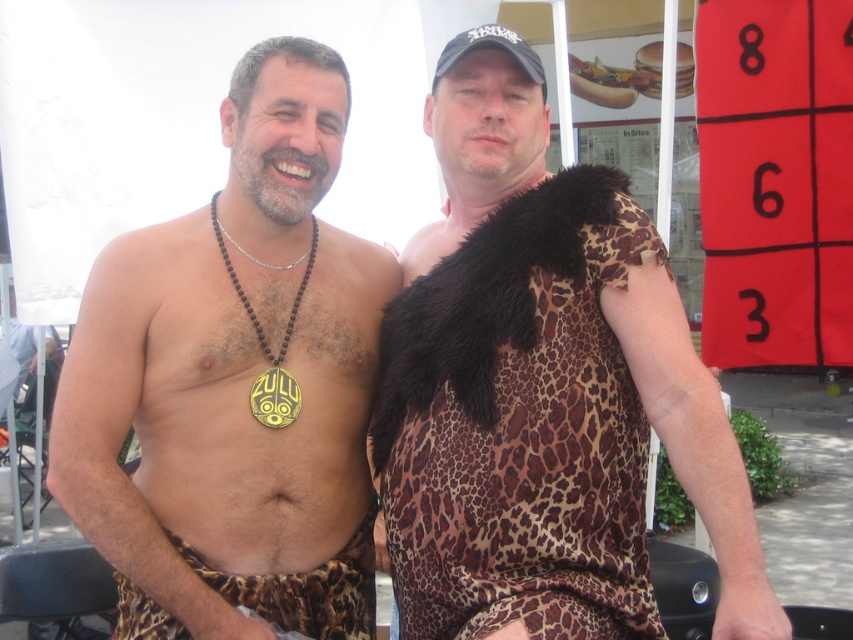
Who is shorter, leopard print loincloth at center or leopard print fabric dress at upper right?

Standing shorter between the two is leopard print fabric dress at upper right.

Does leopard print loincloth at center have a lesser width compared to leopard print fabric dress at upper right?

No.

Between point (254, 381) and point (567, 262), which one is positioned behind?

The point (254, 381) is behind.

Where is `leopard print loincloth at center`? leopard print loincloth at center is located at coordinates (235, 384).

Between point (440, 400) and point (352, 541), which one is positioned in front?

Point (440, 400) is more forward.

Based on the photo, is leopard print fabric dress at upper right bigger than leopard print fabric at lower center?

Yes.

Who is more forward, (x=535, y=449) or (x=183, y=630)?

Point (x=535, y=449) is more forward.

What are the coordinates of `leopard print fabric dress at upper right` in the screenshot? It's located at (519, 424).

Does point (370, 572) come closer to viewer compared to point (367, 589)?

No.

Which is behind, point (183, 326) or point (128, 620)?

The point (183, 326) is behind.

Which is in front, point (305, 504) or point (165, 532)?

Positioned in front is point (165, 532).

Identify the location of leopard print loincloth at center. The height and width of the screenshot is (640, 853). (235, 384).